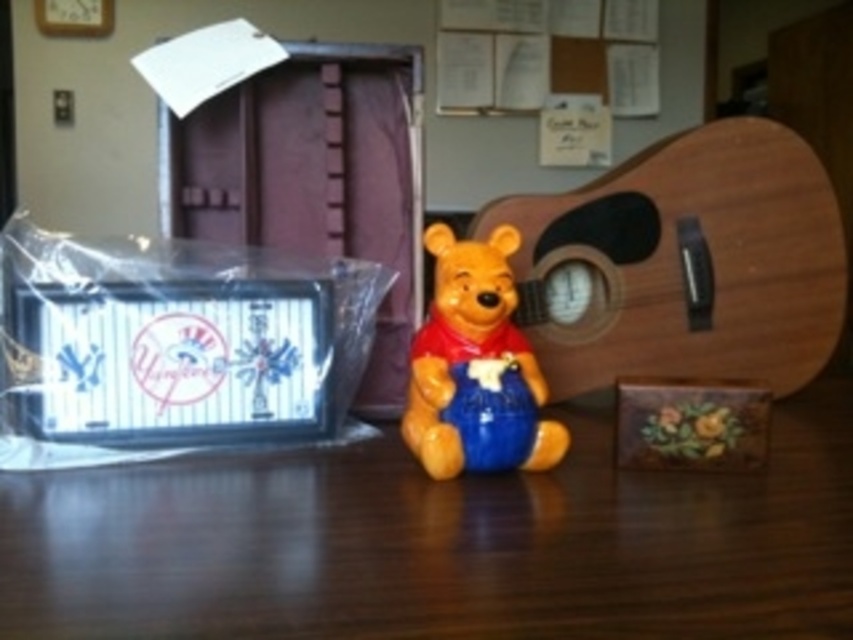
Question: Is wooden at center above matte ceramic bear at center?

Choices:
 (A) no
 (B) yes

Answer: (A)

Question: Is wooden at center thinner than matte ceramic bear at center?

Choices:
 (A) no
 (B) yes

Answer: (A)

Question: Can you confirm if wooden at center is thinner than matte ceramic bear at center?

Choices:
 (A) yes
 (B) no

Answer: (B)

Question: Which object appears closest to the camera in this image?

Choices:
 (A) wooden at center
 (B) matte ceramic bear at center

Answer: (A)

Question: Which point is farther from the camera taking this photo?

Choices:
 (A) (474, 298)
 (B) (99, 531)

Answer: (A)